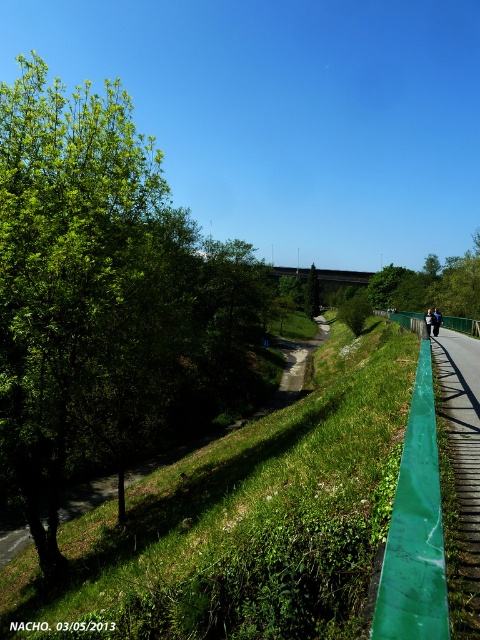
You are planning to take a photo of the green leafy tree at left and the dark blue jacket at center. Since you want both objects to be clearly visible in the frame, which object should you focus on first to ensure proper depth of field?

The green leafy tree at left is larger in size than the dark blue jacket at center, so focusing on the larger object first would help ensure both are in focus.

You are standing at the point with coordinates point (427, 310) and want to walk to the point with coordinates point (20, 288). According to the scene, which direction should you face to move towards your destination?

You should face downward because point (20, 288) is in front of point (427, 310).

You are standing on the pathway in the scene and notice both the green leafy tree at center and the dark blue jacket at center. Which object is positioned higher relative to the other?

The green leafy tree at center is located above the dark blue jacket at center, so it is positioned higher.